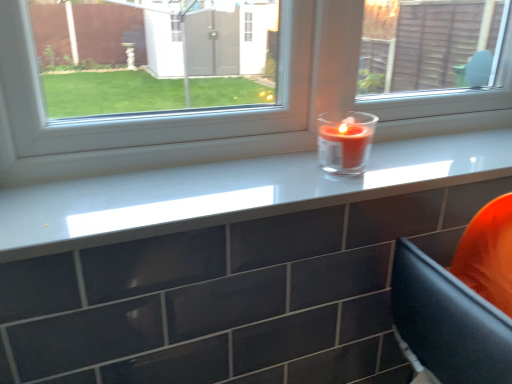
Identify the location of free space on the front side of translucent glass candle at center. This screenshot has width=512, height=384. (331, 188).